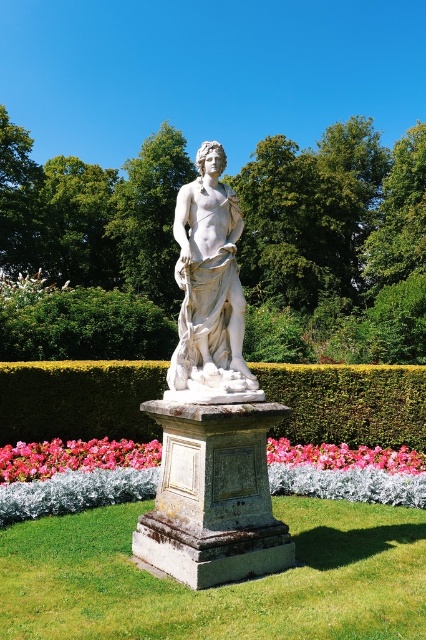
You are a gardener who needs to water the pink fabric flower at lower center and the green hedge at center. Your watering can has a range of 10 feet. If you are standing next to the classical statue, can you water both plants without moving?

The distance between the green hedge at center and the pink fabric flower at lower center is 9.45 feet. Since your watering can has a range of 10 feet, you can water both plants without moving from the classical statue.

You are standing at point (209, 291) in the garden. What object is located exactly at your current position?

The white marble statue at center is located exactly at point (209, 291).